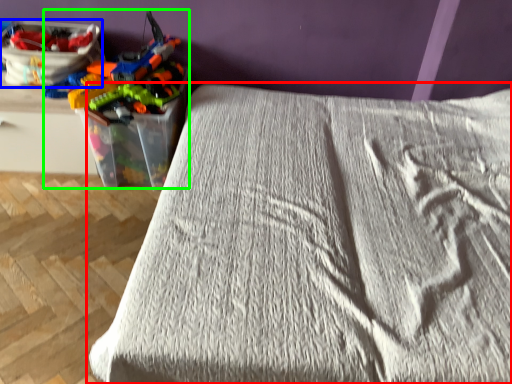
Question: Considering the real-world distances, which object is closest to bed (highlighted by a red box)? equipment (highlighted by a blue box) or toy (highlighted by a green box).

Choices:
 (A) equipment
 (B) toy

Answer: (B)